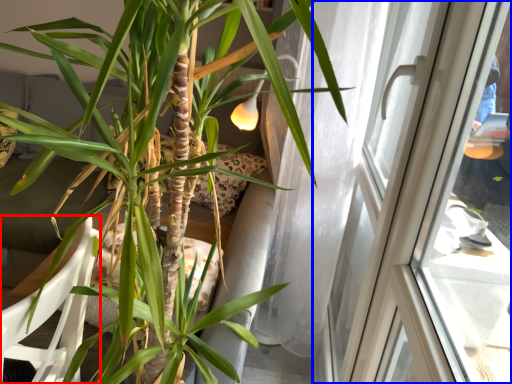
Question: Which of the following is the closest to the observer, armchair (highlighted by a red box) or window (highlighted by a blue box)?

Choices:
 (A) armchair
 (B) window

Answer: (A)